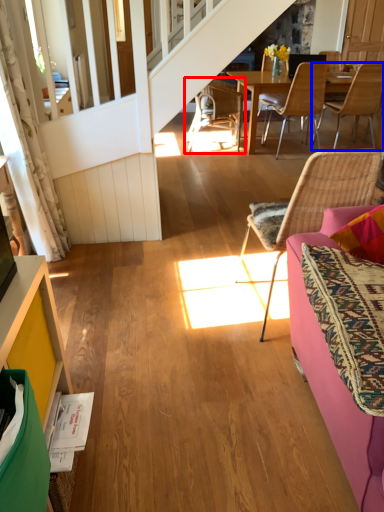
Question: Among these objects, which one is nearest to the camera, chair (highlighted by a red box) or chair (highlighted by a blue box)?

Choices:
 (A) chair
 (B) chair

Answer: (B)